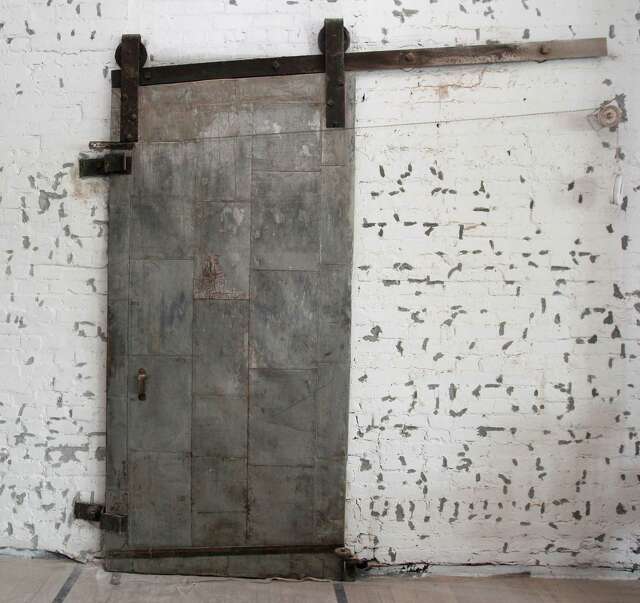
Locate an element on the screen. cracks in wall is located at coordinates (59, 551), (381, 570), (435, 570).